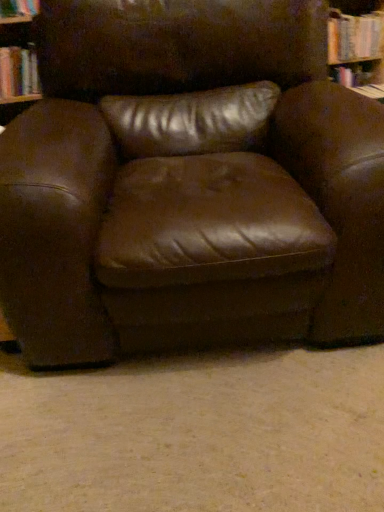
Where is `brown leather chair at center`? The image size is (384, 512). brown leather chair at center is located at coordinates (189, 183).

The width and height of the screenshot is (384, 512). What do you see at coordinates (189, 183) in the screenshot?
I see `brown leather chair at center` at bounding box center [189, 183].

The image size is (384, 512). Describe the element at coordinates (18, 72) in the screenshot. I see `hardcover book at upper left` at that location.

Find the location of a particular element. The image size is (384, 512). hardcover book at upper left is located at coordinates (18, 72).

The height and width of the screenshot is (512, 384). I want to click on brown leather chair at center, so click(x=189, y=183).

Is hardcover book at upper left to the left or to the right of brown leather chair at center in the image?

Based on their positions, hardcover book at upper left is located to the left of brown leather chair at center.

Is the depth of hardcover book at upper left less than that of brown leather chair at center?

No, it is not.

Is point (24, 63) behind point (224, 150)?

Yes, it is.

From the image's perspective, which one is positioned lower, hardcover book at upper left or brown leather chair at center?

From the image's view, brown leather chair at center is below.

In the scene shown: From a real-world perspective, does hardcover book at upper left stand above brown leather chair at center?

Indeed, from a real-world perspective, hardcover book at upper left stands above brown leather chair at center.

Which object is wider, hardcover book at upper left or brown leather chair at center?

brown leather chair at center is wider.

Considering the sizes of objects hardcover book at upper left and brown leather chair at center in the image provided, who is taller, hardcover book at upper left or brown leather chair at center?

With more height is brown leather chair at center.

Which of these two, hardcover book at upper left or brown leather chair at center, is bigger?

brown leather chair at center.

Choose the correct answer: Is hardcover book at upper left inside brown leather chair at center or outside it?

hardcover book at upper left is located beyond the bounds of brown leather chair at center.

Is hardcover book at upper left placed right next to brown leather chair at center?

No, hardcover book at upper left is not next to brown leather chair at center.

Could you tell me if hardcover book at upper left is facing brown leather chair at center?

Yes, hardcover book at upper left is turned towards brown leather chair at center.

Can you tell me how much hardcover book at upper left and brown leather chair at center differ in facing direction?

hardcover book at upper left and brown leather chair at center are facing 10.6 degrees away from each other.

Measure the distance from hardcover book at upper left to brown leather chair at center.

A distance of 3.73 feet exists between hardcover book at upper left and brown leather chair at center.

At what (x,y) coordinates should I click in order to perform the action: click on book behind the brown leather chair at center. Please return your answer as a coordinate pair (x, y). The image size is (384, 512). Looking at the image, I should click on (18, 72).

Considering the positions of objects brown leather chair at center and hardcover book at upper left in the image provided, who is more to the left, brown leather chair at center or hardcover book at upper left?

hardcover book at upper left is more to the left.

Considering the positions of objects brown leather chair at center and hardcover book at upper left in the image provided, who is in front, brown leather chair at center or hardcover book at upper left?

brown leather chair at center is closer to the camera.

Is point (321, 129) more distant than point (1, 71)?

No, (321, 129) is closer to viewer.

From the image's perspective, which is above, brown leather chair at center or hardcover book at upper left?

hardcover book at upper left.

From a real-world perspective, is brown leather chair at center positioned above or below hardcover book at upper left?

In terms of real-world spatial position, brown leather chair at center is below hardcover book at upper left.

Which of these two, brown leather chair at center or hardcover book at upper left, is wider?

Wider between the two is brown leather chair at center.

Which of these two, brown leather chair at center or hardcover book at upper left, stands shorter?

With less height is hardcover book at upper left.

Does brown leather chair at center have a smaller size compared to hardcover book at upper left?

No.

Can hardcover book at upper left be found inside brown leather chair at center?

No, hardcover book at upper left is not surrounded by brown leather chair at center.

Does brown leather chair at center touch hardcover book at upper left?

brown leather chair at center and hardcover book at upper left are not in contact.

Is brown leather chair at center aimed at hardcover book at upper left?

No, brown leather chair at center is not turned towards hardcover book at upper left.

Locate an element on the screen. book that appears above the brown leather chair at center (from a real-world perspective) is located at coordinates 18,72.

This screenshot has width=384, height=512. Identify the location of book that is above the brown leather chair at center (from the image's perspective). (18, 72).

Locate an element on the screen. The width and height of the screenshot is (384, 512). chair in front of the hardcover book at upper left is located at coordinates (189, 183).